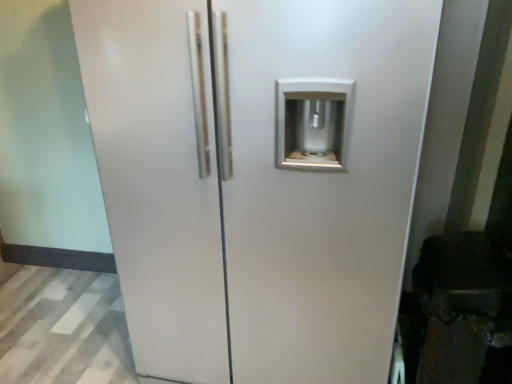
This screenshot has height=384, width=512. Describe the element at coordinates (259, 178) in the screenshot. I see `satin white refrigerator at center` at that location.

This screenshot has height=384, width=512. In order to click on satin white refrigerator at center in this screenshot , I will do `click(259, 178)`.

This screenshot has height=384, width=512. I want to click on satin white refrigerator at center, so click(259, 178).